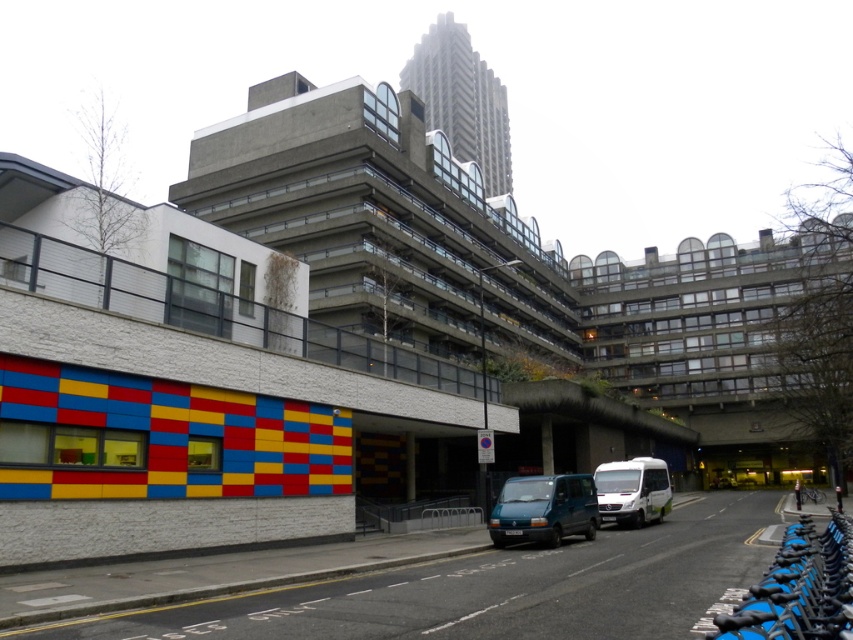
Is teal matte van at center thinner than white matte van at center-right?

Indeed, teal matte van at center has a lesser width compared to white matte van at center-right.

Does teal matte van at center appear over white matte van at center-right?

Yes, teal matte van at center is above white matte van at center-right.

Describe the element at coordinates (543, 509) in the screenshot. I see `teal matte van at center` at that location.

Locate an element on the screen. The width and height of the screenshot is (853, 640). teal matte van at center is located at coordinates (543, 509).